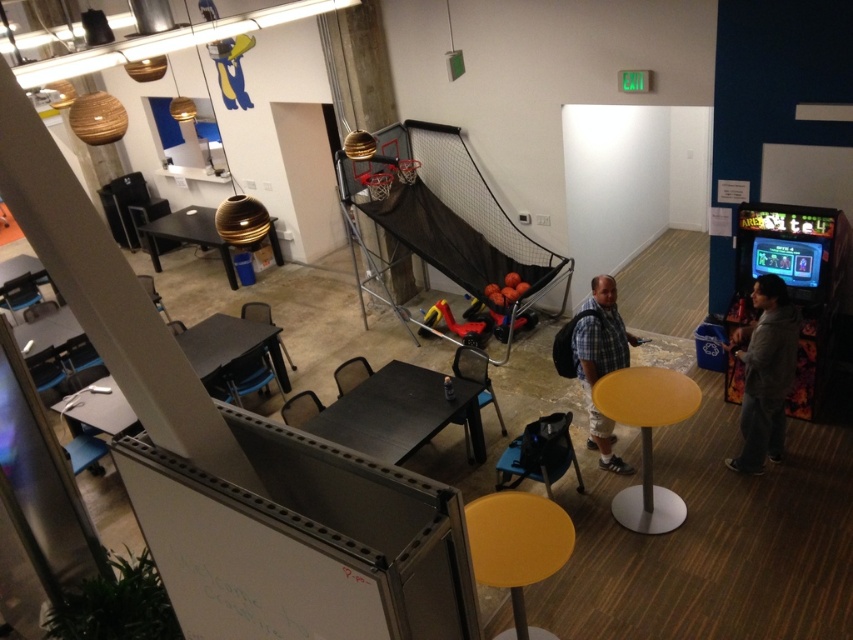
You are organizing a small event and need to place a 16 feet long banner between the black matte table at center and the wooden table at center. Is there enough space for the banner to fit between them without bending it?

The distance between the black matte table at center and the wooden table at center is 15.87 feet. Since the banner is 16 feet long, it is slightly longer than the available space. Therefore, the banner cannot fit straight between them without bending.

You are organizing a small event in the recreational area and need to place a 1.5 meters tall decoration. Can the gray hoodie at right and the yellow matte table at center accommodate this decoration in terms of height?

The gray hoodie at right has a greater height compared to the yellow matte table at center. Since the decoration is 1.5 meters tall, the gray hoodie at right may be able to support it if its height is sufficient, but the yellow matte table at center is shorter and likely cannot accommodate the decoration.

You are standing in the indoor recreational area and need to locate the gray hoodie at right. According to the coordinates provided, where would you find it?

The gray hoodie at right is located at point (x=764, y=372).